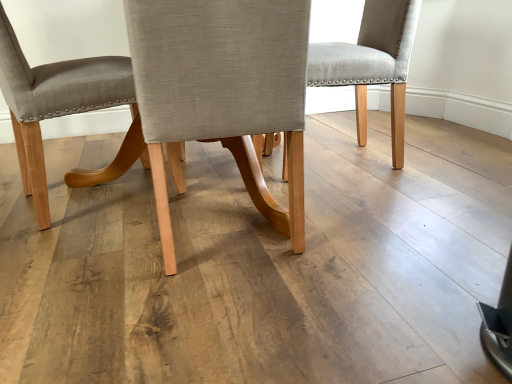
Question: Does point (334, 41) appear closer or farther from the camera than point (51, 99)?

Choices:
 (A) closer
 (B) farther

Answer: (B)

Question: Visually, is light gray fabric chair at center, the 1th chair when ordered from right to left, positioned to the left or to the right of matte gray fabric chair at center, which appears as the first chair when viewed from the left?

Choices:
 (A) right
 (B) left

Answer: (A)

Question: Based on their relative distances, which object is farther from the light gray fabric chair at center, the 1th chair when ordered from right to left?

Choices:
 (A) matte gray fabric chair at center, which appears as the first chair when viewed from the left
 (B) light gray fabric chair at center, which is counted as the second chair, starting from the left

Answer: (A)

Question: Estimate the real-world distances between objects in this image. Which object is farther from the light gray fabric chair at center, which is counted as the second chair, starting from the left?

Choices:
 (A) matte gray fabric chair at center, placed as the third chair when sorted from right to left
 (B) light gray fabric chair at center, which is the third chair in left-to-right order

Answer: (B)